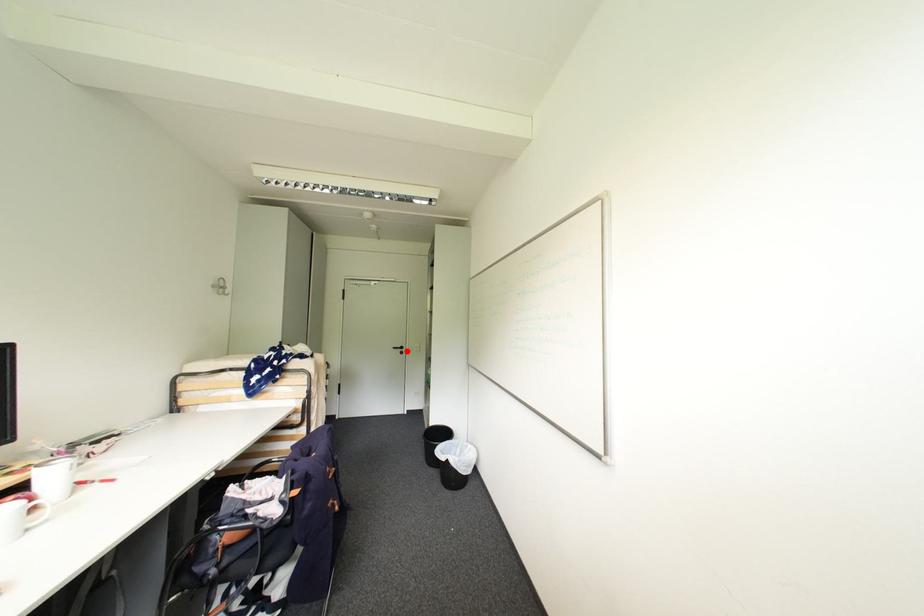
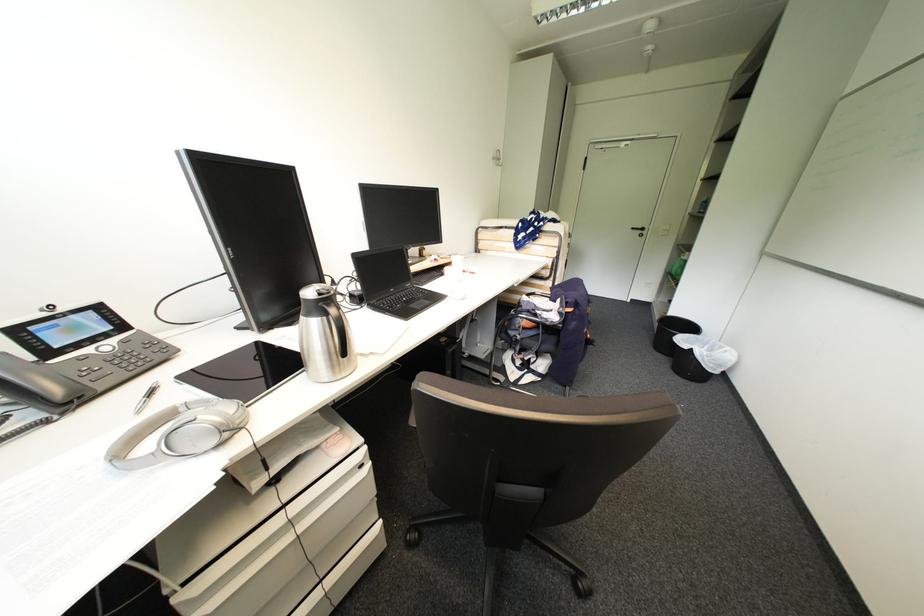
In the second image, find the point that corresponds to the highlighted location in the first image.

(648, 233)